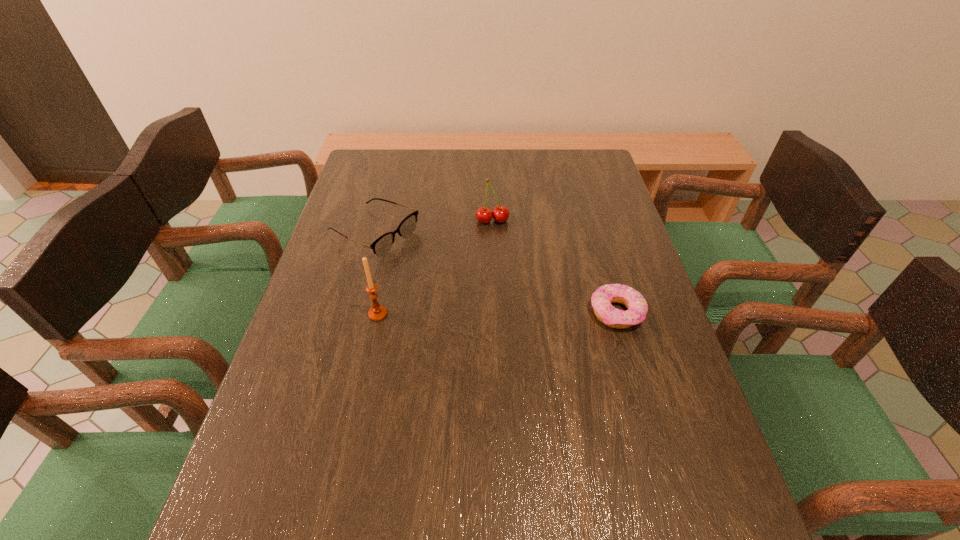
Where is `vacant space at the far left corner`? vacant space at the far left corner is located at coordinates (396, 179).

I want to click on free space at the far right corner of the desktop, so click(x=591, y=183).

The image size is (960, 540). Find the location of `free space at the near right corner of the desktop`. free space at the near right corner of the desktop is located at coordinates click(715, 481).

Identify the location of free spot between the spectacles and the third shortest object. (433, 227).

I want to click on free area in between the second object from right to left and the doughnut, so click(x=555, y=267).

You are a GUI agent. You are given a task and a screenshot of the screen. Output one action in this format:
    pyautogui.click(x=<x>, y=<y>)
    Task: Click on the blank region between the third shortest object and the second shortest object
    Image resolution: width=960 pixels, height=540 pixels.
    Given the screenshot: What is the action you would take?
    point(433,227)

This screenshot has height=540, width=960. What are the coordinates of `blank region between the rightmost object and the tallest object` in the screenshot? It's located at (497, 313).

Find the location of `unoccupied position between the rightmost object and the second shortest object`. unoccupied position between the rightmost object and the second shortest object is located at coordinates (495, 273).

The height and width of the screenshot is (540, 960). I want to click on free space between the third tallest object and the cherry, so click(x=433, y=227).

Where is `free spot between the candle_holder and the doughnut`? Image resolution: width=960 pixels, height=540 pixels. free spot between the candle_holder and the doughnut is located at coordinates (497, 313).